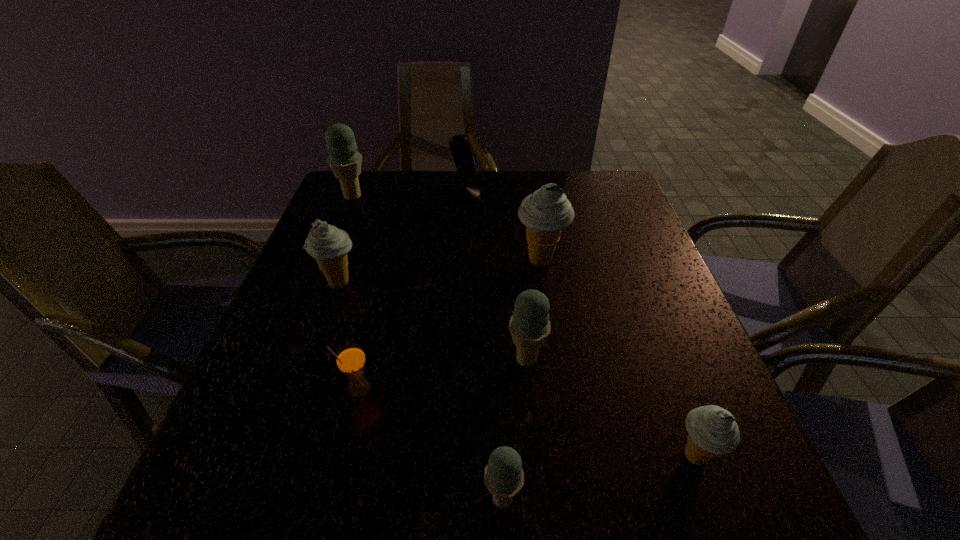
At what (x,y) coordinates should I click in order to perform the action: click on free region located 0.210m on the left of the rightmost beige icecream. Please return your answer as a coordinate pair (x, y). The image size is (960, 540). Looking at the image, I should click on (538, 456).

Identify the location of free space located 0.130m on the back of the smallest blue ice cream. (499, 403).

Identify the location of ice cream located in the far edge section of the desktop. The image size is (960, 540). (x=345, y=161).

Where is `microphone positioned at the far edge`? microphone positioned at the far edge is located at coordinates (465, 162).

Locate an element on the screen. The height and width of the screenshot is (540, 960). object located at the right edge is located at coordinates (712, 430).

Where is `object that is at the far left corner`? This screenshot has height=540, width=960. object that is at the far left corner is located at coordinates (345, 161).

Find the location of `object that is at the near right corner`. object that is at the near right corner is located at coordinates (712, 430).

Image resolution: width=960 pixels, height=540 pixels. In order to click on vacant region at the far edge of the desktop in this screenshot , I will do `click(544, 179)`.

I want to click on free region at the near edge of the desktop, so click(519, 518).

At what (x,y) coordinates should I click in order to perform the action: click on free space at the left edge. Please return your answer as a coordinate pair (x, y). Looking at the image, I should click on (256, 393).